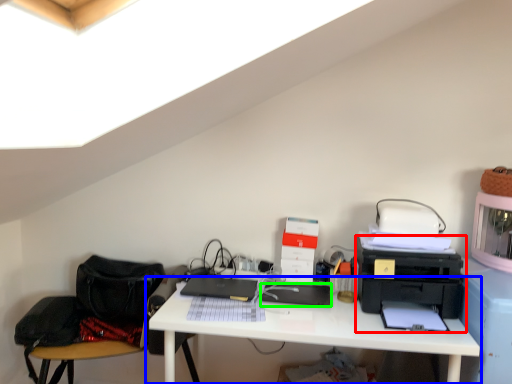
Question: Based on their relative distances, which object is farther from printer (highlighted by a red box)? Choose from desk (highlighted by a blue box) and register (highlighted by a green box).

Choices:
 (A) desk
 (B) register

Answer: (B)